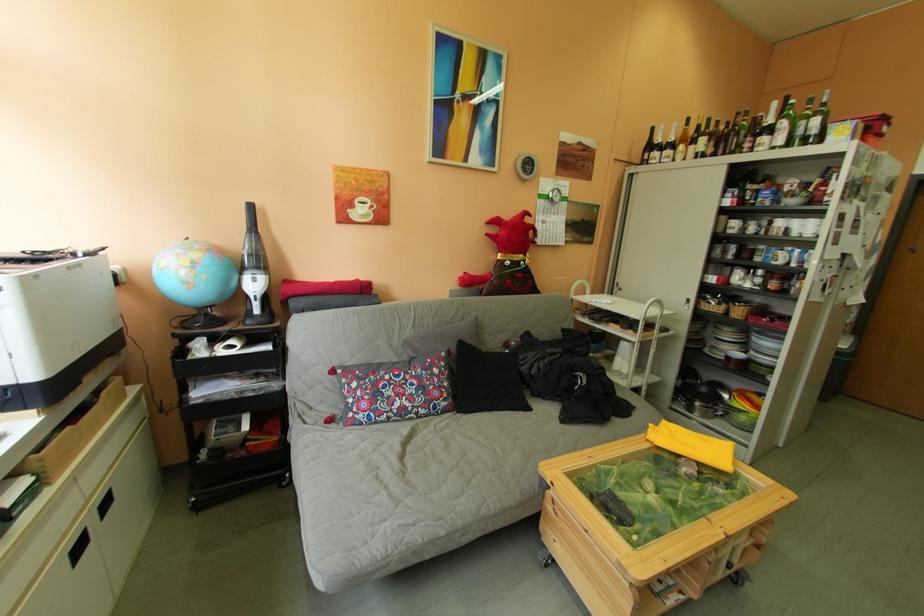
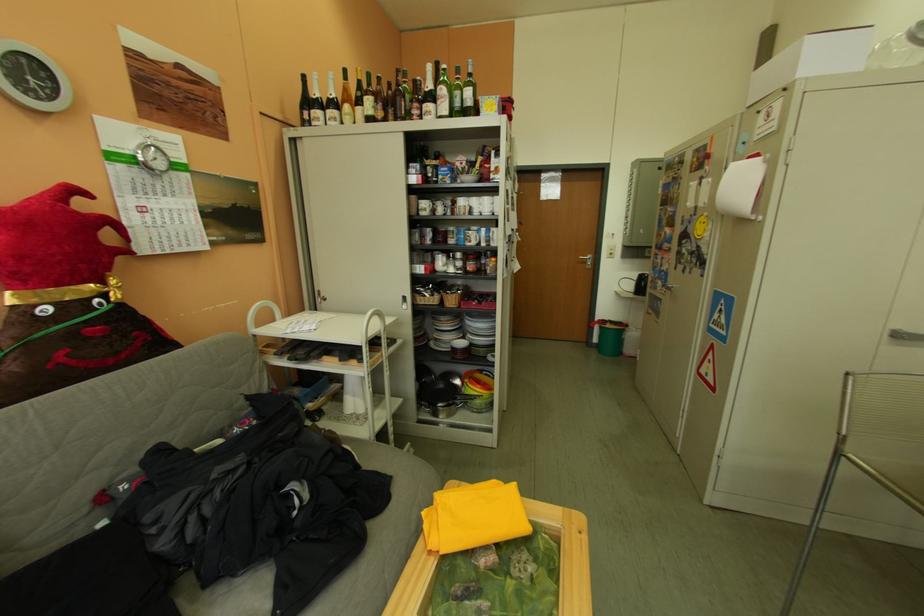
Question: How did the camera likely rotate?

Choices:
 (A) Left
 (B) Right
 (C) Up
 (D) Down

Answer: (B)